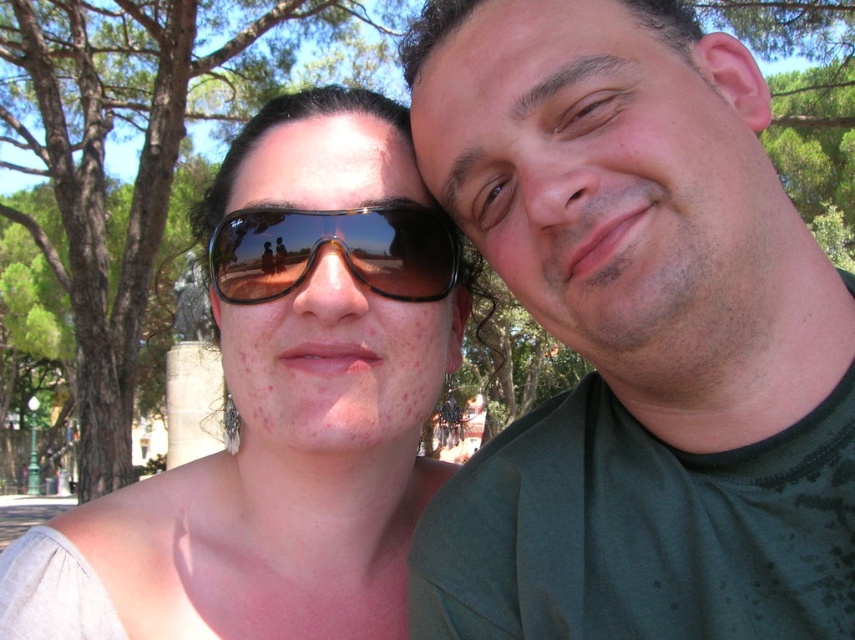
Consider the image. You are a photographer trying to focus on the green matte shirt at right and the matte black sunglasses at upper left. Which object is positioned more to the right side of the image?

The green matte shirt at right is positioned more to the right side of the image than the matte black sunglasses at upper left.

You are a photographer trying to capture a closeup of the green matte shirt at right and the matte black sunglasses at upper left. Which object should you focus on first if you want to ensure both are in focus?

The green matte shirt at right is above the matte black sunglasses at upper left, so focusing on the green matte shirt at right first will help ensure both are in focus as it is closer to the camera.

You are a photographer trying to capture the matte black sunglasses at upper left in your shot. Based on their position at point 0.634, 0.331, would you adjust your camera to focus on the upper left quadrant of the image?

Yes, the matte black sunglasses at upper left are located at point (282, 404), which falls within the upper left quadrant of the image, so focusing there would be appropriate.